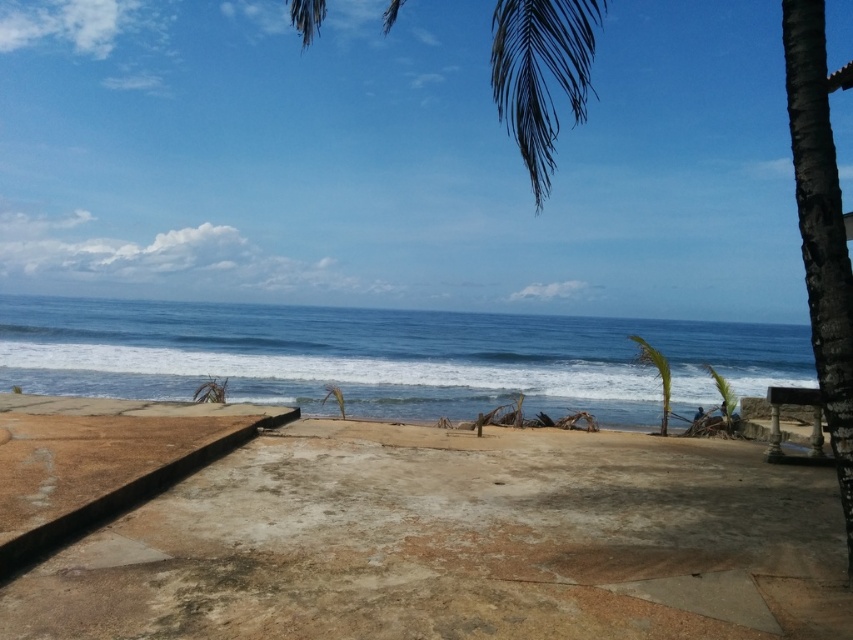
Question: In this image, where is green leafy palm tree at center-right located relative to green leafy palm tree at right?

Choices:
 (A) below
 (B) above

Answer: (B)

Question: Observing the image, what is the correct spatial positioning of green leafy palm tree at upper right in reference to green leafy palm tree at right?

Choices:
 (A) right
 (B) left

Answer: (B)

Question: Among these points, which one is farthest from the camera?

Choices:
 (A) [x=316, y=426]
 (B) [x=728, y=404]
 (C) [x=666, y=419]

Answer: (B)

Question: Can you confirm if green leafy palm tree at upper right is positioned to the left of green leafy palm tree at center-right?

Choices:
 (A) no
 (B) yes

Answer: (B)

Question: Which point is farther to the camera?

Choices:
 (A) green leafy palm tree at upper right
 (B) brown concrete beach at lower center
 (C) green leafy palm tree at right

Answer: (C)

Question: Which point is farther to the camera?

Choices:
 (A) brown concrete beach at lower center
 (B) green leafy palm tree at center-right

Answer: (B)